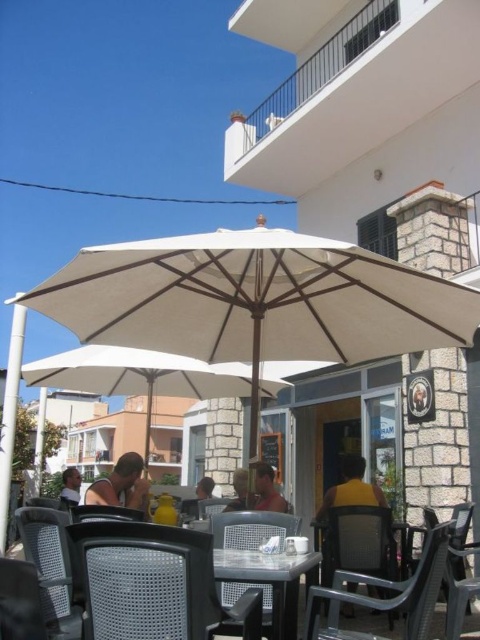
Can you confirm if black mesh chair at lower left is positioned above black plastic chair at lower left?

Correct, black mesh chair at lower left is located above black plastic chair at lower left.

Is black mesh chair at lower left to the left of black plastic chair at lower left from the viewer's perspective?

In fact, black mesh chair at lower left is to the right of black plastic chair at lower left.

Does point (120, 552) come behind point (84, 512)?

No, it is in front of (84, 512).

Where is `black mesh chair at lower left`? black mesh chair at lower left is located at coordinates (144, 580).

Is the position of black mesh chair at lower left more distant than that of brown leather jacket at center?

That is False.

Between point (156, 611) and point (208, 480), which one is positioned behind?

Positioned behind is point (208, 480).

I want to click on black mesh chair at lower left, so click(x=144, y=580).

Locate an element on the screen. This screenshot has width=480, height=640. black mesh chair at lower left is located at coordinates (144, 580).

Is black mesh chair at lower left bigger than matte plastic chair at center?

No, black mesh chair at lower left is not bigger than matte plastic chair at center.

Is point (84, 595) less distant than point (215, 509)?

Yes, point (84, 595) is closer to viewer.

I want to click on black mesh chair at lower left, so click(144, 580).